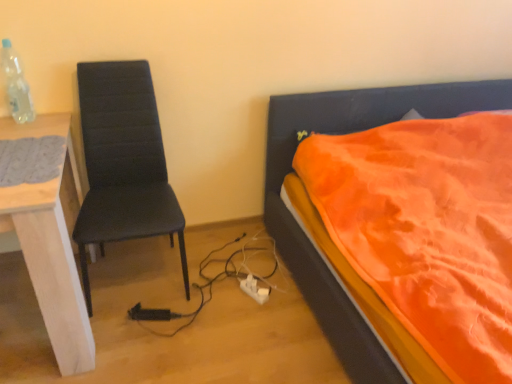
Where is `vacant space to the right of clear plastic bottle at upper left`? vacant space to the right of clear plastic bottle at upper left is located at coordinates (54, 120).